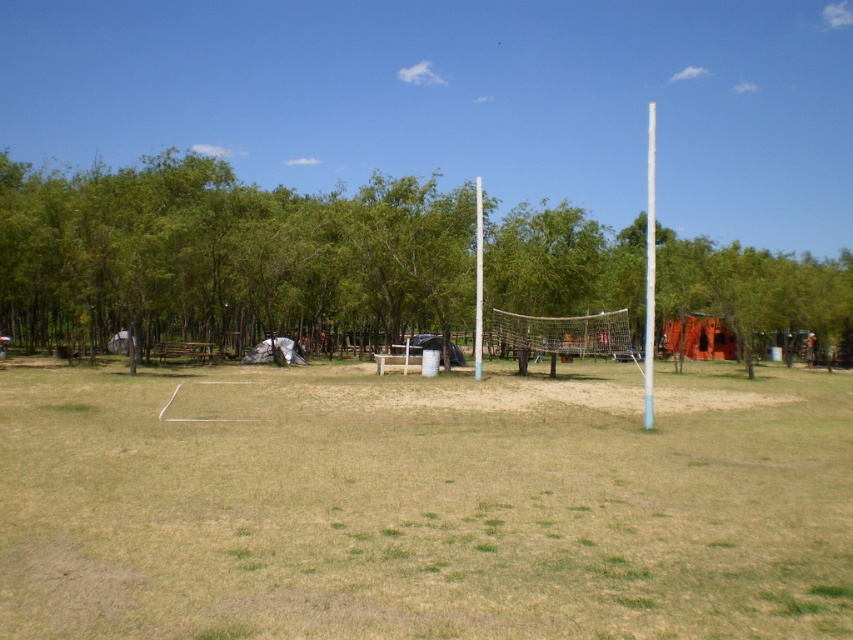
Does point (448, 289) lie behind point (477, 212)?

That is True.

Consider the image. Who is more distant from viewer, [196,156] or [480,193]?

Positioned behind is point [196,156].

Between point (78, 262) and point (474, 257), which one is positioned in front?

Point (78, 262)

Where is `green leafy tree at center`? Image resolution: width=853 pixels, height=640 pixels. green leafy tree at center is located at coordinates (225, 253).

Is green grass at center bigger than green leafy tree at center?

No, green grass at center is not bigger than green leafy tree at center.

Is green grass at center to the left of green leafy tree at center from the viewer's perspective?

Incorrect, green grass at center is not on the left side of green leafy tree at center.

Find the location of `green grass at center`. green grass at center is located at coordinates (422, 504).

Locate an element on the screen. The height and width of the screenshot is (640, 853). green grass at center is located at coordinates (422, 504).

Between blue plastic pole at right and white metallic pole at center, which one is positioned higher?

Positioned higher is blue plastic pole at right.

Does blue plastic pole at right appear under white metallic pole at center?

No.

Does point (653, 164) come in front of point (479, 324)?

No.

This screenshot has height=640, width=853. Find the location of `blue plastic pole at right`. blue plastic pole at right is located at coordinates (648, 275).